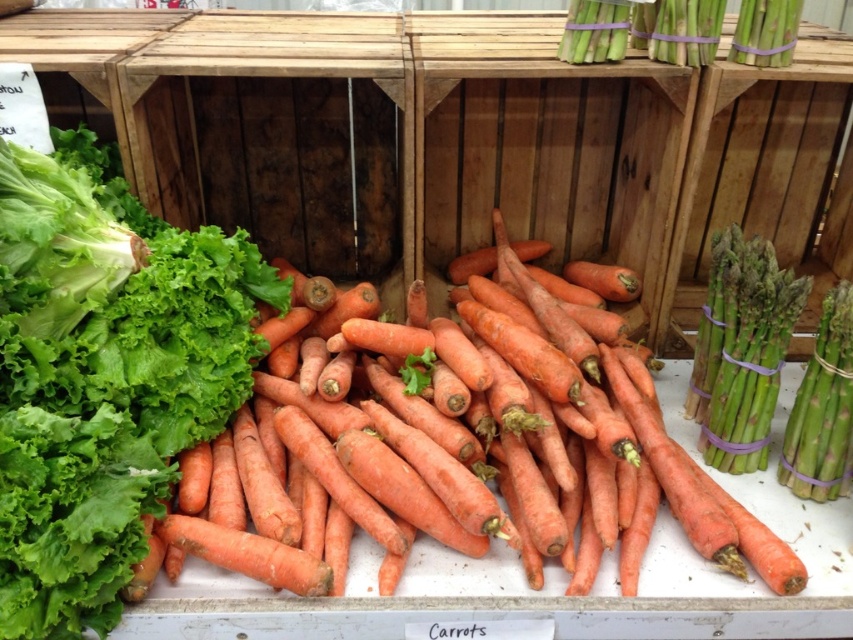
You are a customer at the market stall looking at the orange matte carrots at left and the orange matte carrots at center. Which pile of carrots is taller?

The orange matte carrots at left is taller than the orange matte carrots at center.

You are a customer at the market stall and want to pick up both the orange matte carrots at left and the green matte asparagus at upper right. Which item will you need to reach further to get?

The green matte asparagus at upper right requires reaching further because it is positioned farther from the viewer compared to the orange matte carrots at left.

You are a customer at the market stall and want to pick up the orange matte carrots at center and the green matte asparagus at upper right. Which one do you need to reach further to grab?

The green matte asparagus at upper right is further away from you than the orange matte carrots at center, so you need to reach further to grab the green matte asparagus at upper right.